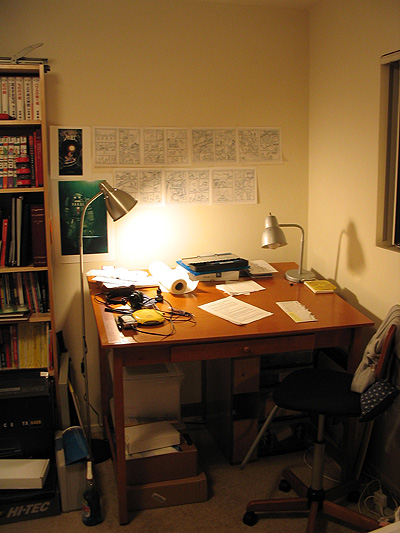
Where is `pillow on desk chair`? The image size is (400, 533). pillow on desk chair is located at coordinates (361, 370), (378, 390).